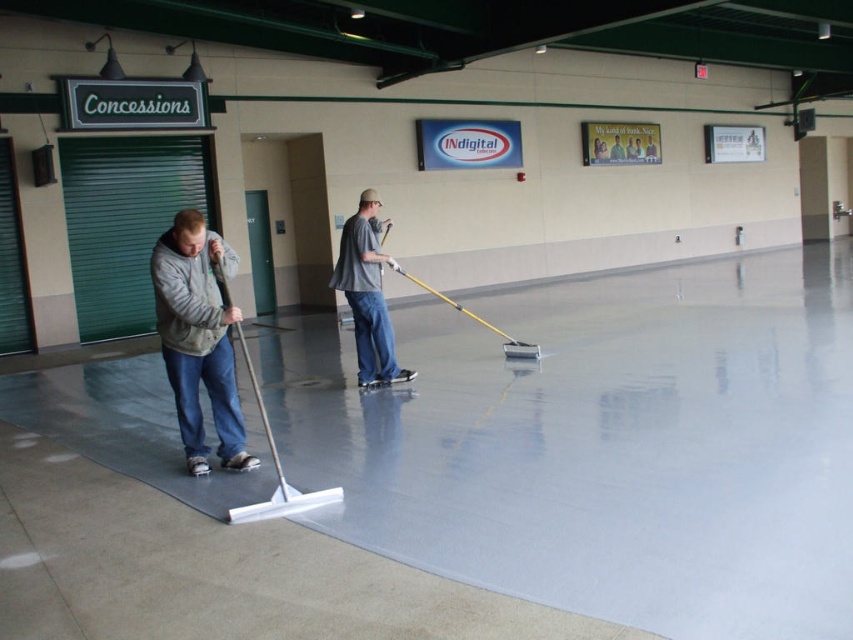
Can you confirm if smooth gray concrete at center is positioned above gray fleece jacket at left?

No.

Which is behind, point (178, 474) or point (193, 264)?

The point (178, 474) is behind.

This screenshot has height=640, width=853. I want to click on smooth gray concrete at center, so click(605, 445).

From the picture: Is smooth gray concrete at center smaller than gray matte shirt at center?

No.

Where is `smooth gray concrete at center`? smooth gray concrete at center is located at coordinates (605, 445).

Who is positioned more to the right, gray fleece jacket at left or gray matte shirt at center?

gray matte shirt at center is more to the right.

What do you see at coordinates (198, 339) in the screenshot? This screenshot has height=640, width=853. I see `gray fleece jacket at left` at bounding box center [198, 339].

Find the location of a particular element. The width and height of the screenshot is (853, 640). gray fleece jacket at left is located at coordinates (198, 339).